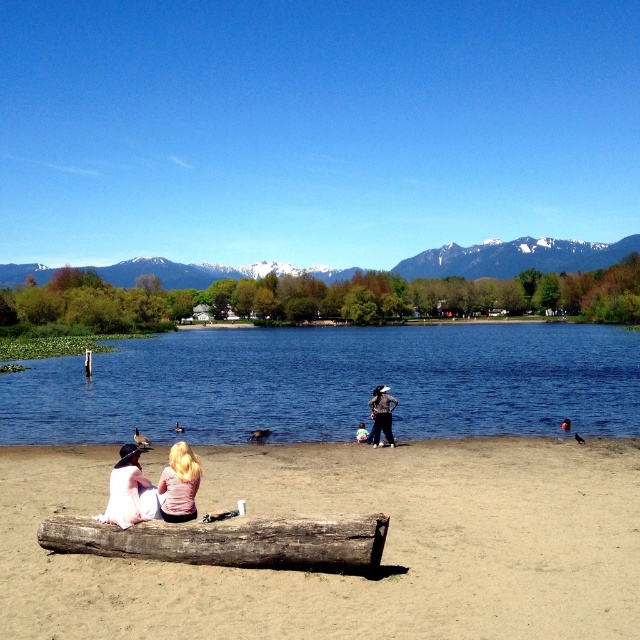
You are a photographer planning to take a group photo of the light pink fabric couple at lower left and the small group of people standing near the water. Based on their positions in the image, can you estimate whether they are in the same general area or separated by distance?

The light pink fabric couple at lower left is located at point (150, 488) in the image, but the exact position of the small group of people near the water isn